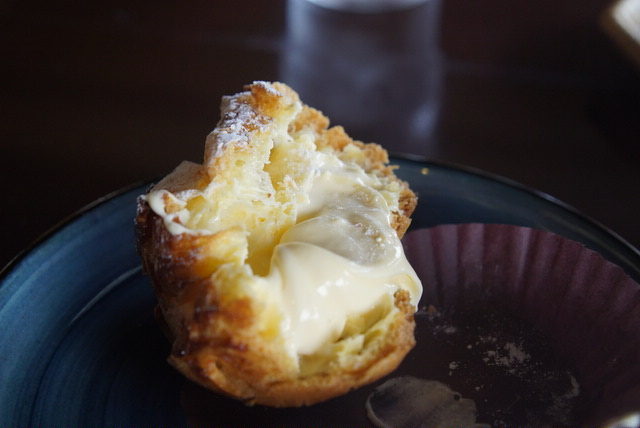
This screenshot has width=640, height=428. What are the coordinates of `glare on table` in the screenshot? It's located at (326, 40).